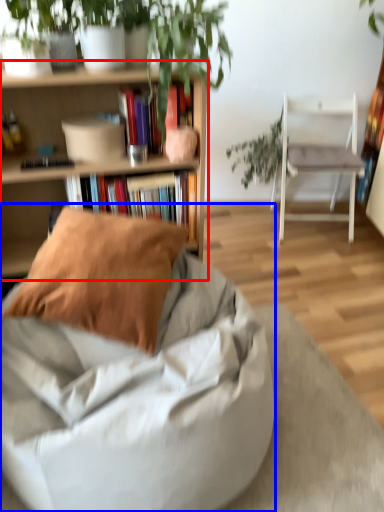
Question: Which point is further to the camera, shelf (highlighted by a red box) or chair (highlighted by a blue box)?

Choices:
 (A) shelf
 (B) chair

Answer: (A)